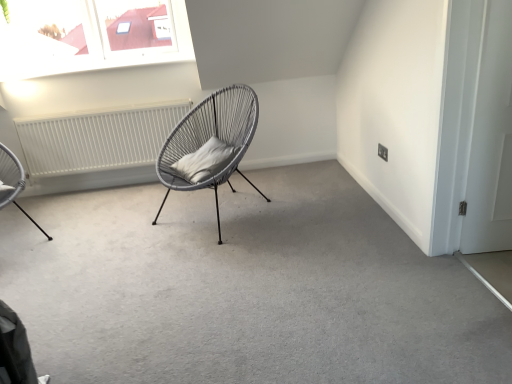
Question: Can you confirm if gray fabric pillow at center is smaller than metallic wire chair at left, which is the 1th chair from left to right?

Choices:
 (A) no
 (B) yes

Answer: (B)

Question: Can you confirm if gray fabric pillow at center is bigger than metallic wire chair at left, which is the 1th chair from left to right?

Choices:
 (A) no
 (B) yes

Answer: (A)

Question: Does gray fabric pillow at center come in front of metallic wire chair at left, which is the second chair from right to left?

Choices:
 (A) no
 (B) yes

Answer: (A)

Question: Is gray fabric pillow at center not close to metallic wire chair at left, which is the second chair from right to left?

Choices:
 (A) no
 (B) yes

Answer: (B)

Question: Is gray fabric pillow at center facing towards metallic wire chair at left, which is the 1th chair from left to right?

Choices:
 (A) no
 (B) yes

Answer: (A)

Question: Considering the relative positions of white matte radiator at left and gray fabric pillow at center in the image provided, is white matte radiator at left to the left or to the right of gray fabric pillow at center?

Choices:
 (A) right
 (B) left

Answer: (B)

Question: Would you say white matte radiator at left is inside or outside gray fabric pillow at center?

Choices:
 (A) inside
 (B) outside

Answer: (B)

Question: In terms of height, does white matte radiator at left look taller or shorter compared to gray fabric pillow at center?

Choices:
 (A) short
 (B) tall

Answer: (B)

Question: From the image's perspective, is white matte radiator at left located above or below gray fabric pillow at center?

Choices:
 (A) above
 (B) below

Answer: (A)

Question: Is white matte door at right situated inside white matte radiator at left or outside?

Choices:
 (A) inside
 (B) outside

Answer: (B)

Question: Is point (470, 147) closer or farther from the camera than point (41, 137)?

Choices:
 (A) closer
 (B) farther

Answer: (A)

Question: Considering the relative positions of white matte door at right and white matte radiator at left in the image provided, is white matte door at right to the left or to the right of white matte radiator at left?

Choices:
 (A) left
 (B) right

Answer: (B)

Question: Considering the positions of white matte door at right and white matte radiator at left in the image, is white matte door at right wider or thinner than white matte radiator at left?

Choices:
 (A) thin
 (B) wide

Answer: (A)

Question: Considering their positions, is white matte door at right located in front of or behind matte grey wicker chair at center, which is counted as the 1th chair, starting from the right?

Choices:
 (A) behind
 (B) front

Answer: (B)

Question: Is point (493, 246) positioned closer to the camera than point (251, 99)?

Choices:
 (A) farther
 (B) closer

Answer: (B)